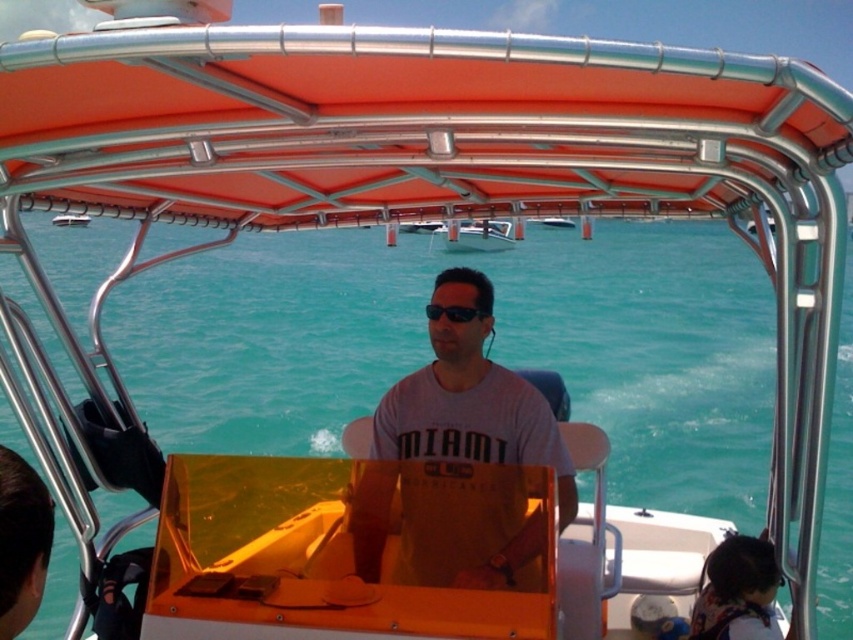
Describe the element at coordinates (469, 401) in the screenshot. Image resolution: width=853 pixels, height=640 pixels. I see `gray matte shirt at center` at that location.

Is gray matte shirt at center smaller than matte gray shirt at center?

Incorrect, gray matte shirt at center is not smaller in size than matte gray shirt at center.

In order to click on gray matte shirt at center in this screenshot , I will do `click(469, 401)`.

Does matte gray shirt at center have a lesser width compared to black matte sunglasses at center?

Yes.

Locate an element on the screen. This screenshot has width=853, height=640. matte gray shirt at center is located at coordinates (21, 541).

What are the coordinates of `matte gray shirt at center` in the screenshot? It's located at (21, 541).

Is metallic silver canopy at upper center wider than metallic silver boat at center?

Indeed, metallic silver canopy at upper center has a greater width compared to metallic silver boat at center.

Does point (598, 17) come in front of point (491, 248)?

No, (598, 17) is behind (491, 248).

Between point (492, 0) and point (486, 246), which one is positioned behind?

The point (492, 0) is more distant.

The height and width of the screenshot is (640, 853). Find the location of `metallic silver canopy at upper center`. metallic silver canopy at upper center is located at coordinates (647, 20).